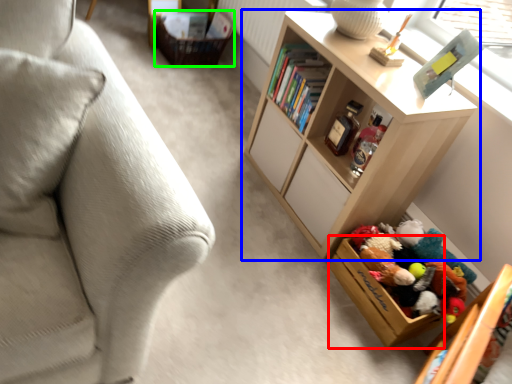
Question: Which object is the closest to the storage box (highlighted by a red box)? Choose among these: shelf (highlighted by a blue box) or storage box (highlighted by a green box).

Choices:
 (A) shelf
 (B) storage box

Answer: (A)